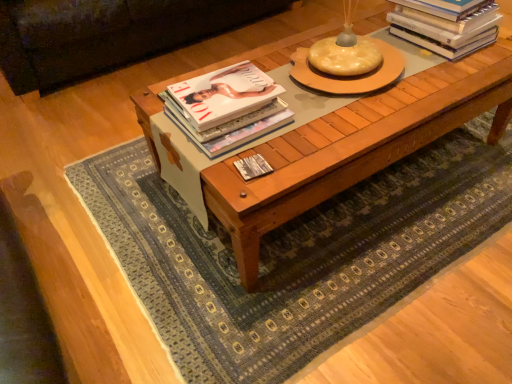
Locate an element on the screen. The width and height of the screenshot is (512, 384). spots to the right of matte hardcover book at center, which appears as the 1th book when viewed from the left is located at coordinates tap(318, 119).